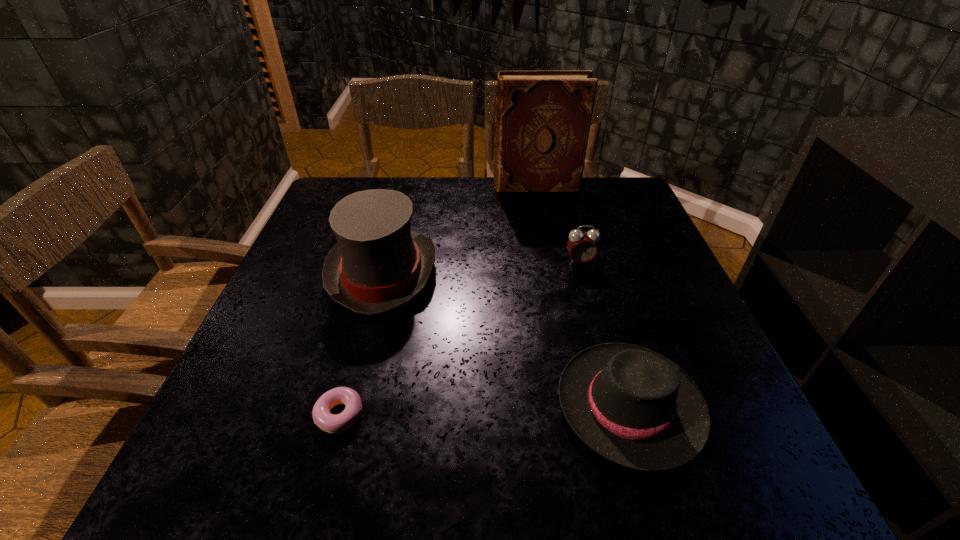
Identify the location of free space located on the spine side of the farthest object. This screenshot has width=960, height=540. (456, 186).

In order to click on vacant point located on the front of the left dress hat in this screenshot , I will do `click(352, 395)`.

Where is `free point located 0.250m on the clock face of the alarm clock`? This screenshot has width=960, height=540. free point located 0.250m on the clock face of the alarm clock is located at coordinates (604, 350).

I want to click on vacant region located 0.120m on the left of the nearer dress hat, so click(488, 406).

Image resolution: width=960 pixels, height=540 pixels. In order to click on free space located 0.130m on the left of the doughnut in this screenshot , I will do `click(237, 415)`.

Locate an element on the screen. This screenshot has width=960, height=540. object that is at the far edge is located at coordinates (543, 119).

The width and height of the screenshot is (960, 540). What are the coordinates of `object present at the near edge` in the screenshot? It's located at (633, 406).

In order to click on object that is positioned at the left edge in this screenshot , I will do `click(378, 264)`.

Find the location of `hardback book situated at the right edge`. hardback book situated at the right edge is located at coordinates (543, 119).

In order to click on dress hat located in the right edge section of the desktop in this screenshot , I will do `click(633, 406)`.